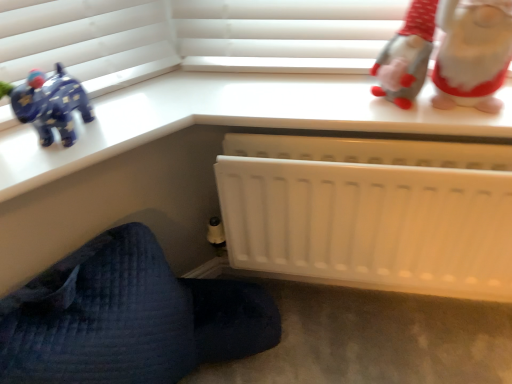
Question: Would you say white plush gnome at upper right is part of white plastic radiator at lower center's contents?

Choices:
 (A) no
 (B) yes

Answer: (A)

Question: Is white plastic radiator at lower center oriented towards white plush gnome at upper right?

Choices:
 (A) yes
 (B) no

Answer: (B)

Question: Is white plastic radiator at lower center not near white plush gnome at upper right?

Choices:
 (A) yes
 (B) no

Answer: (B)

Question: From the image's perspective, would you say white plastic radiator at lower center is positioned over white plush gnome at upper right?

Choices:
 (A) no
 (B) yes

Answer: (A)

Question: Considering the relative positions of white plastic radiator at lower center and white plush gnome at upper right in the image provided, is white plastic radiator at lower center in front of white plush gnome at upper right?

Choices:
 (A) yes
 (B) no

Answer: (B)

Question: Is white plastic radiator at lower center taller than white plush gnome at upper right?

Choices:
 (A) yes
 (B) no

Answer: (A)

Question: Can you confirm if white plastic radiator at lower center is thinner than white matte radiator at lower right?

Choices:
 (A) no
 (B) yes

Answer: (B)

Question: Is white plastic radiator at lower center directly adjacent to white matte radiator at lower right?

Choices:
 (A) yes
 (B) no

Answer: (B)

Question: Is white plastic radiator at lower center taller than white matte radiator at lower right?

Choices:
 (A) yes
 (B) no

Answer: (A)

Question: Is white plastic radiator at lower center positioned before white matte radiator at lower right?

Choices:
 (A) yes
 (B) no

Answer: (B)

Question: Is white plastic radiator at lower center facing towards white matte radiator at lower right?

Choices:
 (A) yes
 (B) no

Answer: (B)

Question: Can we say white plastic radiator at lower center lies outside white matte radiator at lower right?

Choices:
 (A) no
 (B) yes

Answer: (B)

Question: From a real-world perspective, is white matte radiator at lower right positioned under white plush gnome at upper right based on gravity?

Choices:
 (A) yes
 (B) no

Answer: (A)